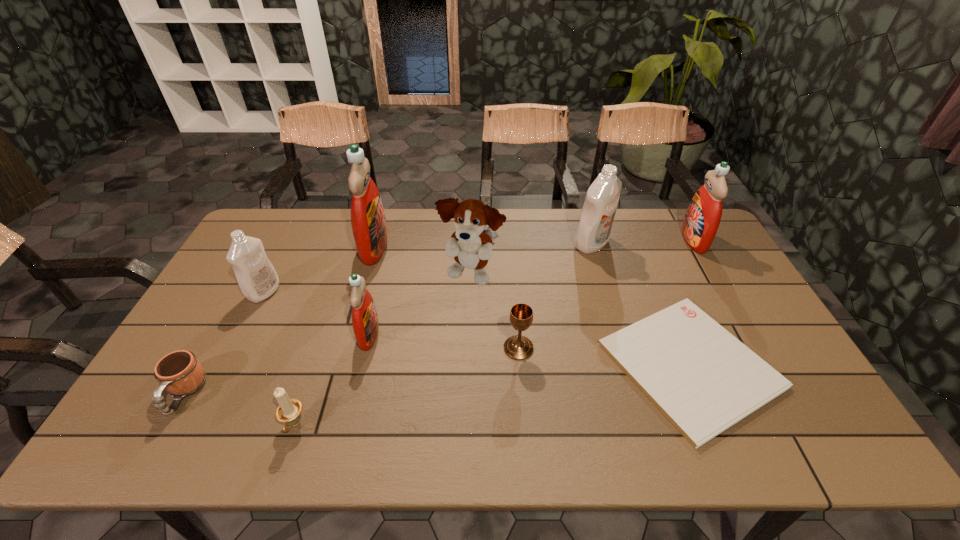
The image size is (960, 540). What are the coordinates of `free location located on the face of the puppy` in the screenshot? It's located at (469, 362).

This screenshot has width=960, height=540. In order to click on free space located on the front of the left white detergent in this screenshot , I will do `click(225, 369)`.

What are the coordinates of `free spot located 0.400m on the front surface of the nearest detergent` in the screenshot? It's located at (522, 334).

This screenshot has height=540, width=960. I want to click on blank space located on the right of the chalice, so click(651, 348).

The image size is (960, 540). Find the location of `blank space located 0.190m on the back of the shortest object`. blank space located 0.190m on the back of the shortest object is located at coordinates (646, 261).

Where is `candle_holder situated at the near edge`? candle_holder situated at the near edge is located at coordinates (288, 411).

I want to click on mug that is at the near edge, so click(180, 373).

Where is `clipboard that is at the near edge`? Image resolution: width=960 pixels, height=540 pixels. clipboard that is at the near edge is located at coordinates (703, 379).

Where is `detergent present at the left edge`? Image resolution: width=960 pixels, height=540 pixels. detergent present at the left edge is located at coordinates (256, 276).

At what (x,y) coordinates should I click in order to perform the action: click on mug located at the left edge. Please return your answer as a coordinate pair (x, y). Looking at the image, I should click on (180, 373).